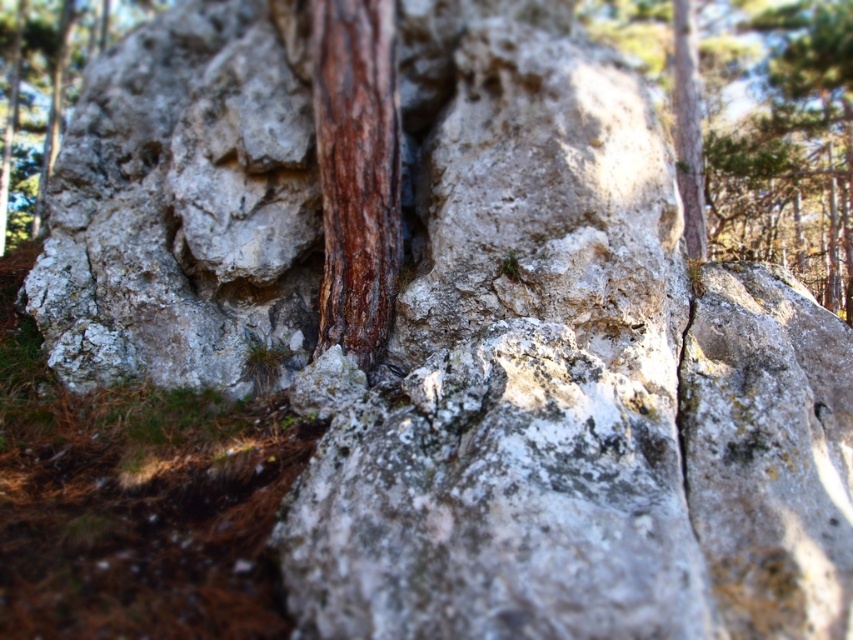
You are a geologist examining the rock formation and want to determine the order of layers based on their visibility. Which point, point [839,113] or point [20,58], is closer to you and thus represents the upper layer?

Point [839,113] is in front of point [20,58], so it is closer and represents the upper layer.

You are a geologist examining the rocky surface shown in the image. You need to locate the brown rough tree trunk at center for analysis. What are the coordinates of its position?

The coordinates of the brown rough tree trunk at center are at point (357, 172).

You are a geologist examining the rock formation. You notice two brown rough objects embedded in the rock. Which one, the brown rough bark at upper right or the brown rough tree trunk at center, has a larger size?

The brown rough bark at upper right is bigger than the brown rough tree trunk at center, so the brown rough bark at upper right has a larger size.